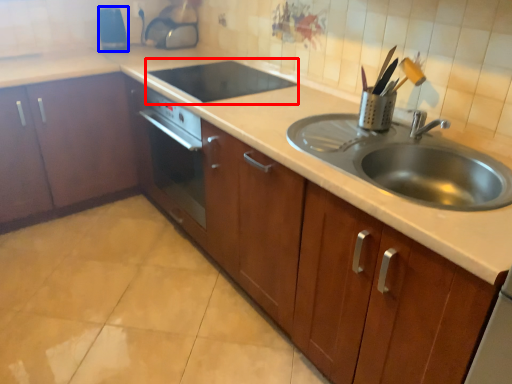
Question: Which object is closer to the camera taking this photo, appliance (highlighted by a red box) or appliance (highlighted by a blue box)?

Choices:
 (A) appliance
 (B) appliance

Answer: (A)